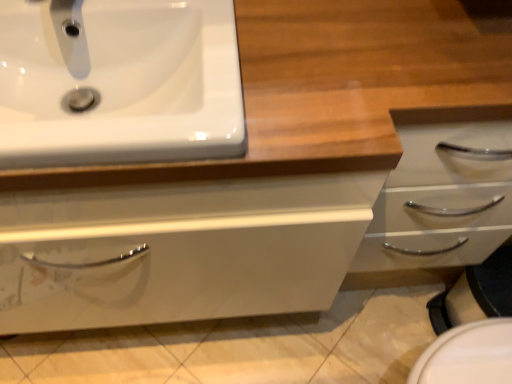
Find the location of a particular element. white glossy sink at upper left is located at coordinates (118, 82).

This screenshot has width=512, height=384. What do you see at coordinates (118, 82) in the screenshot?
I see `white glossy sink at upper left` at bounding box center [118, 82].

Image resolution: width=512 pixels, height=384 pixels. Describe the element at coordinates (67, 35) in the screenshot. I see `matte white faucet at upper left` at that location.

This screenshot has width=512, height=384. What are the coordinates of `matte white faucet at upper left` in the screenshot? It's located at (67, 35).

In order to face matte white faucet at upper left, should I rotate leftwards or rightwards?

You should rotate left by 25.674 degrees.

Measure the distance between matte white faucet at upper left and camera.

matte white faucet at upper left is 24.97 inches from camera.

Locate an element on the screen. white glossy sink at upper left is located at coordinates (118, 82).

From the picture: Is white glossy sink at upper left to the left or to the right of matte white faucet at upper left in the image?

From the image, it's evident that white glossy sink at upper left is to the right of matte white faucet at upper left.

Who is more distant, white glossy sink at upper left or matte white faucet at upper left?

matte white faucet at upper left.

Does point (59, 79) come closer to viewer compared to point (76, 64)?

No, (59, 79) is further to viewer.

In the scene shown: From the image's perspective, is white glossy sink at upper left located beneath matte white faucet at upper left?

Yes, from the image's perspective, white glossy sink at upper left is below matte white faucet at upper left.

From a real-world perspective, between white glossy sink at upper left and matte white faucet at upper left, who is vertically lower?

In real-world perspective, white glossy sink at upper left is lower.

From the picture: Is white glossy sink at upper left wider than matte white faucet at upper left?

Indeed, white glossy sink at upper left has a greater width compared to matte white faucet at upper left.

Looking at this image, which of these two, white glossy sink at upper left or matte white faucet at upper left, stands taller?

Standing taller between the two is matte white faucet at upper left.

Which of these two, white glossy sink at upper left or matte white faucet at upper left, is bigger?

Bigger between the two is white glossy sink at upper left.

Is white glossy sink at upper left not within matte white faucet at upper left?

white glossy sink at upper left is positioned outside matte white faucet at upper left.

Is there a large distance between white glossy sink at upper left and matte white faucet at upper left?

No, there isn't a large distance between white glossy sink at upper left and matte white faucet at upper left.

Could you tell me if white glossy sink at upper left is turned towards matte white faucet at upper left?

No, white glossy sink at upper left does not turn towards matte white faucet at upper left.

The image size is (512, 384). In order to click on plumbing fixture above the white glossy sink at upper left (from the image's perspective) in this screenshot , I will do `click(67, 35)`.

Is matte white faucet at upper left at the left side of white glossy sink at upper left?

Yes, matte white faucet at upper left is to the left of white glossy sink at upper left.

Considering the relative positions of matte white faucet at upper left and white glossy sink at upper left in the image provided, is matte white faucet at upper left behind white glossy sink at upper left?

Yes, the depth of matte white faucet at upper left is greater than that of white glossy sink at upper left.

Which is more distant, (47, 22) or (113, 53)?

Point (113, 53)

From the picture: From the image's perspective, between matte white faucet at upper left and white glossy sink at upper left, who is located below?

white glossy sink at upper left, from the image's perspective.

From a real-world perspective, who is located higher, matte white faucet at upper left or white glossy sink at upper left?

From a 3D spatial view, matte white faucet at upper left is above.

Does matte white faucet at upper left have a lesser width compared to white glossy sink at upper left?

Correct, the width of matte white faucet at upper left is less than that of white glossy sink at upper left.

Is matte white faucet at upper left taller or shorter than white glossy sink at upper left?

In the image, matte white faucet at upper left appears to be taller than white glossy sink at upper left.

Considering the sizes of matte white faucet at upper left and white glossy sink at upper left in the image, is matte white faucet at upper left bigger or smaller than white glossy sink at upper left?

In the image, matte white faucet at upper left appears to be smaller than white glossy sink at upper left.

Which is correct: matte white faucet at upper left is inside white glossy sink at upper left, or outside of it?

matte white faucet at upper left is not inside white glossy sink at upper left, it's outside.

Is matte white faucet at upper left directly adjacent to white glossy sink at upper left?

No, matte white faucet at upper left is not touching white glossy sink at upper left.

Is matte white faucet at upper left facing towards white glossy sink at upper left?

No, matte white faucet at upper left is not oriented towards white glossy sink at upper left.

Locate an element on the screen. The image size is (512, 384). sink lying in front of the matte white faucet at upper left is located at coordinates (118, 82).

There is a white glossy sink at upper left. At what (x,y) coordinates should I click in order to perform the action: click on plumbing fixture above it (from a real-world perspective). Please return your answer as a coordinate pair (x, y). This screenshot has width=512, height=384. Looking at the image, I should click on (67, 35).

Find the location of a particular element. The image size is (512, 384). sink lying in front of the matte white faucet at upper left is located at coordinates (118, 82).